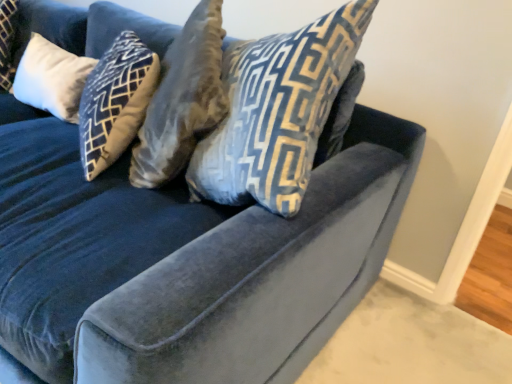
This screenshot has height=384, width=512. Identify the location of velvet blue pillow at center, which is counted as the 1th pillow, starting from the front. (277, 111).

What do you see at coordinates (277, 111) in the screenshot? I see `velvet blue pillow at center, arranged as the 2th pillow when viewed from the left` at bounding box center [277, 111].

Where is `white soft cushion at upper left, which is the 1th pillow from left to right`? The height and width of the screenshot is (384, 512). white soft cushion at upper left, which is the 1th pillow from left to right is located at coordinates (51, 78).

Describe the element at coordinates (51, 78) in the screenshot. The height and width of the screenshot is (384, 512). I see `white soft cushion at upper left, which appears as the 2th pillow when viewed from the front` at that location.

Where is `velvet blue pillow at center, which is counted as the 1th pillow, starting from the front`? velvet blue pillow at center, which is counted as the 1th pillow, starting from the front is located at coordinates (277, 111).

Does velvet blue pillow at center, arranged as the 2th pillow when viewed from the left, appear on the right side of white soft cushion at upper left, the second pillow in the right-to-left sequence?

Yes, velvet blue pillow at center, arranged as the 2th pillow when viewed from the left, is to the right of white soft cushion at upper left, the second pillow in the right-to-left sequence.

In the scene shown: Is the depth of velvet blue pillow at center, which is counted as the 1th pillow, starting from the front, less than that of white soft cushion at upper left, which appears as the 2th pillow when viewed from the front?

Yes, it is in front of white soft cushion at upper left, which appears as the 2th pillow when viewed from the front.

Based on the photo, which is less distant, [239,203] or [54,76]?

The point [239,203] is in front.

From the image's perspective, is velvet blue pillow at center, the 1th pillow when ordered from right to left, located above white soft cushion at upper left, which is the 1th pillow from left to right?

Incorrect, from the image's perspective, velvet blue pillow at center, the 1th pillow when ordered from right to left, is lower than white soft cushion at upper left, which is the 1th pillow from left to right.

From a real-world perspective, which object rests below the other?

In real-world perspective, white soft cushion at upper left, the second pillow in the right-to-left sequence, is lower.

Can you confirm if velvet blue pillow at center, the 1th pillow when ordered from right to left, is wider than white soft cushion at upper left, positioned as the first pillow in back-to-front order?

Correct, the width of velvet blue pillow at center, the 1th pillow when ordered from right to left, exceeds that of white soft cushion at upper left, positioned as the first pillow in back-to-front order.

Is velvet blue pillow at center, which ranks as the 2th pillow in back-to-front order, taller than white soft cushion at upper left, positioned as the first pillow in back-to-front order?

Indeed, velvet blue pillow at center, which ranks as the 2th pillow in back-to-front order, has a greater height compared to white soft cushion at upper left, positioned as the first pillow in back-to-front order.

Which of these two, velvet blue pillow at center, which ranks as the 2th pillow in back-to-front order, or white soft cushion at upper left, which is the 1th pillow from left to right, is smaller?

Smaller between the two is white soft cushion at upper left, which is the 1th pillow from left to right.

Is velvet blue pillow at center, arranged as the 2th pillow when viewed from the left, inside the boundaries of white soft cushion at upper left, which is the 1th pillow from left to right, or outside?

velvet blue pillow at center, arranged as the 2th pillow when viewed from the left, exists outside the volume of white soft cushion at upper left, which is the 1th pillow from left to right.

Can you see velvet blue pillow at center, which is counted as the 1th pillow, starting from the front, touching white soft cushion at upper left, which is the 1th pillow from left to right?

No.

Is velvet blue pillow at center, which ranks as the 2th pillow in back-to-front order, facing away from white soft cushion at upper left, positioned as the first pillow in back-to-front order?

velvet blue pillow at center, which ranks as the 2th pillow in back-to-front order, is not turned away from white soft cushion at upper left, positioned as the first pillow in back-to-front order.

Looking at this image, how different are the orientations of velvet blue pillow at center, arranged as the 2th pillow when viewed from the left, and white soft cushion at upper left, which appears as the 2th pillow when viewed from the front, in degrees?

The angular difference between velvet blue pillow at center, arranged as the 2th pillow when viewed from the left, and white soft cushion at upper left, which appears as the 2th pillow when viewed from the front, is 0.357 degrees.

This screenshot has height=384, width=512. I want to click on pillow located below the white soft cushion at upper left, which appears as the 2th pillow when viewed from the front (from the image's perspective), so click(x=277, y=111).

Is white soft cushion at upper left, which is the 1th pillow from left to right, to the right of velvet blue pillow at center, which ranks as the 2th pillow in back-to-front order, from the viewer's perspective?

No.

Between white soft cushion at upper left, which appears as the 2th pillow when viewed from the front, and velvet blue pillow at center, which ranks as the 2th pillow in back-to-front order, which one is positioned in front?

velvet blue pillow at center, which ranks as the 2th pillow in back-to-front order, is in front.

Does point (60, 117) lie behind point (283, 94)?

Yes.

From the image's perspective, between white soft cushion at upper left, which appears as the 2th pillow when viewed from the front, and velvet blue pillow at center, the 1th pillow when ordered from right to left, which one is located above?

white soft cushion at upper left, which appears as the 2th pillow when viewed from the front, appears higher in the image.

From a real-world perspective, which is physically above, white soft cushion at upper left, which appears as the 2th pillow when viewed from the front, or velvet blue pillow at center, which ranks as the 2th pillow in back-to-front order?

velvet blue pillow at center, which ranks as the 2th pillow in back-to-front order, is physically above.

Does white soft cushion at upper left, which is the 1th pillow from left to right, have a greater width compared to velvet blue pillow at center, arranged as the 2th pillow when viewed from the left?

Incorrect, the width of white soft cushion at upper left, which is the 1th pillow from left to right, does not surpass that of velvet blue pillow at center, arranged as the 2th pillow when viewed from the left.

Who is shorter, white soft cushion at upper left, which is the 1th pillow from left to right, or velvet blue pillow at center, arranged as the 2th pillow when viewed from the left?

Standing shorter between the two is white soft cushion at upper left, which is the 1th pillow from left to right.

Which of these two, white soft cushion at upper left, which is the 1th pillow from left to right, or velvet blue pillow at center, which ranks as the 2th pillow in back-to-front order, is bigger?

velvet blue pillow at center, which ranks as the 2th pillow in back-to-front order.

Based on the photo, choose the correct answer: Is white soft cushion at upper left, the second pillow in the right-to-left sequence, inside velvet blue pillow at center, arranged as the 2th pillow when viewed from the left, or outside it?

white soft cushion at upper left, the second pillow in the right-to-left sequence, lies outside velvet blue pillow at center, arranged as the 2th pillow when viewed from the left.

Is white soft cushion at upper left, positioned as the first pillow in back-to-front order, aimed at velvet blue pillow at center, the 1th pillow when ordered from right to left?

No, white soft cushion at upper left, positioned as the first pillow in back-to-front order, does not turn towards velvet blue pillow at center, the 1th pillow when ordered from right to left.

How many degrees apart are the facing directions of white soft cushion at upper left, positioned as the first pillow in back-to-front order, and velvet blue pillow at center, which ranks as the 2th pillow in back-to-front order?

They differ by 0.357 degrees in their facing directions.

You are a GUI agent. You are given a task and a screenshot of the screen. Output one action in this format:
    pyautogui.click(x=<x>, y=<y>)
    Task: Click on the pillow lying behind the velvet blue pillow at center, which ranks as the 2th pillow in back-to-front order
    Image resolution: width=512 pixels, height=384 pixels.
    Given the screenshot: What is the action you would take?
    pyautogui.click(x=51, y=78)

At what (x,y) coordinates should I click in order to perform the action: click on pillow located underneath the velvet blue pillow at center, which ranks as the 2th pillow in back-to-front order (from a real-world perspective). Please return your answer as a coordinate pair (x, y). Looking at the image, I should click on (51, 78).

The image size is (512, 384). In order to click on pillow located below the white soft cushion at upper left, positioned as the first pillow in back-to-front order (from the image's perspective) in this screenshot , I will do `click(277, 111)`.